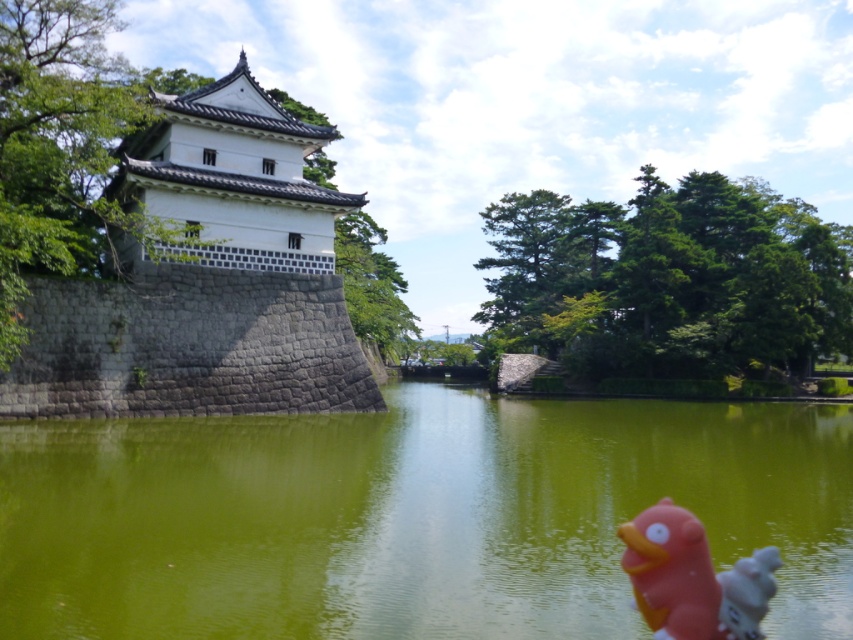
Question: Is white stone wall at left positioned at the back of rubber duck at lower right?

Choices:
 (A) no
 (B) yes

Answer: (B)

Question: Is green stone water at center wider than rubber duck at lower right?

Choices:
 (A) yes
 (B) no

Answer: (A)

Question: Considering the real-world distances, which object is closest to the green stone water at center?

Choices:
 (A) white stone wall at left
 (B) rubber duck at lower right

Answer: (B)

Question: Based on their relative distances, which object is nearer to the green stone water at center?

Choices:
 (A) white stone wall at left
 (B) rubber duck at lower right

Answer: (B)

Question: Is the position of green stone water at center more distant than that of rubber duck at lower right?

Choices:
 (A) yes
 (B) no

Answer: (A)

Question: Which point is closer to the camera?

Choices:
 (A) (129, 376)
 (B) (660, 506)

Answer: (B)